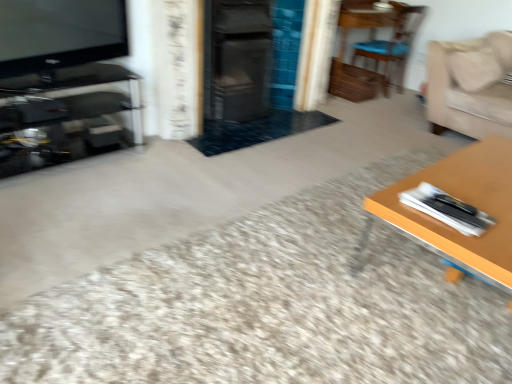
Question: From a real-world perspective, is beige fabric couch at upper right on top of wooden table at right?

Choices:
 (A) no
 (B) yes

Answer: (B)

Question: Is wooden table at right located within beige fabric couch at upper right?

Choices:
 (A) no
 (B) yes

Answer: (A)

Question: From the image's perspective, would you say beige fabric couch at upper right is shown under wooden table at right?

Choices:
 (A) yes
 (B) no

Answer: (B)

Question: Is beige fabric couch at upper right at the right side of wooden table at right?

Choices:
 (A) yes
 (B) no

Answer: (A)

Question: Does beige fabric couch at upper right have a lesser width compared to wooden table at right?

Choices:
 (A) yes
 (B) no

Answer: (A)

Question: From a real-world perspective, is matte black tv at upper left positioned above or below wooden chair at upper right?

Choices:
 (A) below
 (B) above

Answer: (B)

Question: Is point 93,28 positioned closer to the camera than point 391,52?

Choices:
 (A) farther
 (B) closer

Answer: (B)

Question: Is matte black tv at upper left wider or thinner than wooden chair at upper right?

Choices:
 (A) thin
 (B) wide

Answer: (A)

Question: Based on their sizes in the image, would you say matte black tv at upper left is bigger or smaller than wooden chair at upper right?

Choices:
 (A) big
 (B) small

Answer: (B)

Question: Based on their sizes in the image, would you say beige fabric couch at upper right is bigger or smaller than wooden table at right?

Choices:
 (A) big
 (B) small

Answer: (B)

Question: From a real-world perspective, relative to wooden table at right, is beige fabric couch at upper right vertically above or below?

Choices:
 (A) below
 (B) above

Answer: (B)

Question: Based on their positions, is beige fabric couch at upper right located to the left or right of wooden table at right?

Choices:
 (A) right
 (B) left

Answer: (A)

Question: From the image's perspective, is beige fabric couch at upper right positioned above or below wooden table at right?

Choices:
 (A) below
 (B) above

Answer: (B)

Question: Considering the positions of matte black tv at upper left and beige fabric couch at upper right in the image, is matte black tv at upper left taller or shorter than beige fabric couch at upper right?

Choices:
 (A) tall
 (B) short

Answer: (B)

Question: Considering their positions, is matte black tv at upper left located in front of or behind beige fabric couch at upper right?

Choices:
 (A) front
 (B) behind

Answer: (A)